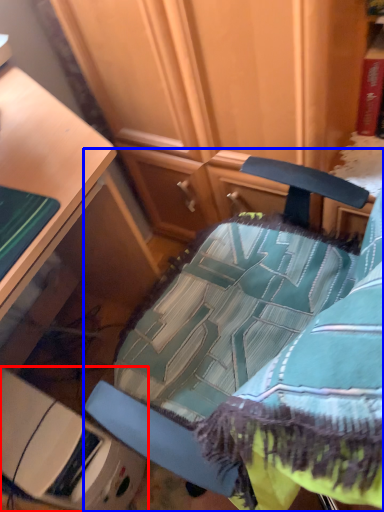
Question: Among these objects, which one is farthest to the camera, furniture (highlighted by a red box) or chair (highlighted by a blue box)?

Choices:
 (A) furniture
 (B) chair

Answer: (A)